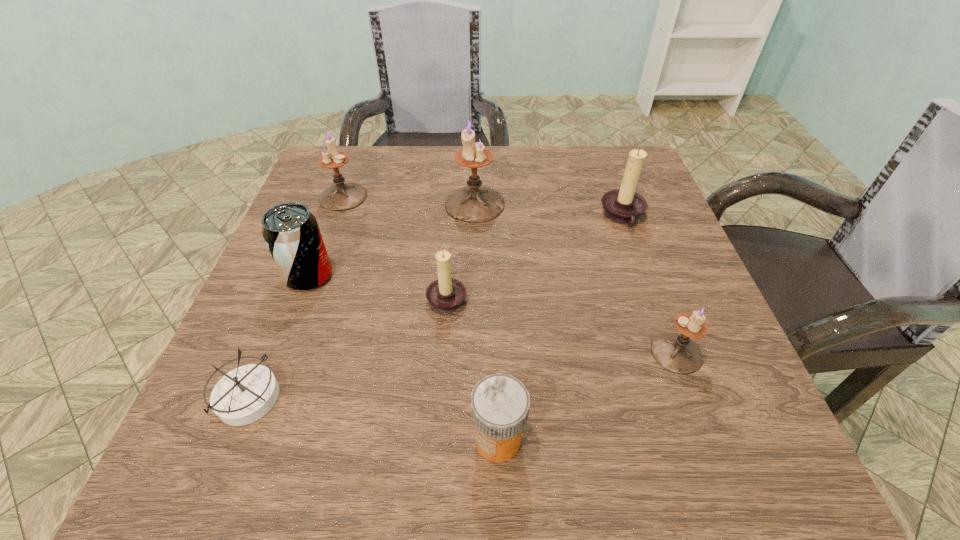
At what (x,y) coordinates should I click in order to perform the action: click on object present at the far left corner. Please return your answer as a coordinate pair (x, y). The width and height of the screenshot is (960, 540). Looking at the image, I should click on (341, 196).

Locate an element on the screen. The height and width of the screenshot is (540, 960). object at the near left corner is located at coordinates (244, 395).

Locate an element on the screen. This screenshot has height=540, width=960. vacant space at the far edge of the desktop is located at coordinates (576, 165).

Find the location of a particular element. vacant space at the near edge of the desktop is located at coordinates (343, 458).

Image resolution: width=960 pixels, height=540 pixels. Identify the location of free location at the left edge. (348, 254).

You are a GUI agent. You are given a task and a screenshot of the screen. Output one action in this format:
    pyautogui.click(x=<x>, y=<y>)
    Task: Click on the vacant space at the right edge
    
    Given the screenshot: What is the action you would take?
    pyautogui.click(x=653, y=389)

Locate an element on the screen. This screenshot has width=960, height=540. vacant region at the far left corner of the desktop is located at coordinates (340, 146).

This screenshot has height=540, width=960. I want to click on free space at the near left corner of the desktop, so click(x=192, y=435).

Locate an element on the screen. The image size is (960, 540). free space at the far right corner of the desktop is located at coordinates (588, 177).

Where is `free space between the soda can and the compass`? The image size is (960, 540). free space between the soda can and the compass is located at coordinates (279, 338).